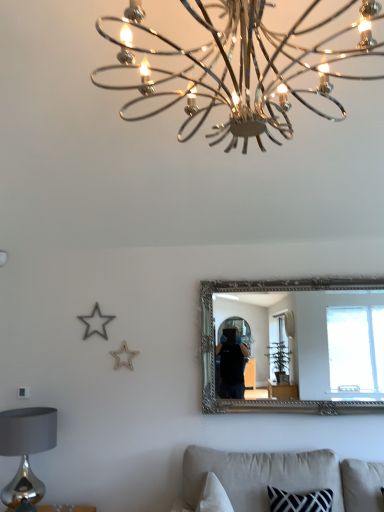
Locate an element on the screen. beige fabric couch at lower center is located at coordinates (282, 478).

What do you see at coordinates (242, 66) in the screenshot?
I see `chrome/metallic chandelier at upper center` at bounding box center [242, 66].

At what (x,y) coordinates should I click in order to perform the action: click on silver ornate mirror at center. Please return your answer as a coordinate pair (x, y). The width and height of the screenshot is (384, 512). Looking at the image, I should click on (318, 339).

Where is `shiny silver table lamp at lower left`? This screenshot has width=384, height=512. shiny silver table lamp at lower left is located at coordinates (26, 449).

From the image's perspective, relative to silver ornate mirror at center, is beige fabric couch at lower center above or below?

From the image's perspective, beige fabric couch at lower center appears below silver ornate mirror at center.

Looking at this image, would you say silver ornate mirror at center is part of beige fabric couch at lower center's contents?

No, silver ornate mirror at center is not surrounded by beige fabric couch at lower center.

Which is nearer, (309, 457) or (337, 303)?

Positioned in front is point (309, 457).

How far apart are beige fabric couch at lower center and silver ornate mirror at center?

beige fabric couch at lower center and silver ornate mirror at center are 3.31 meters apart.

Considering the sizes of objects silver ornate mirror at center and shiny silver table lamp at lower left in the image provided, who is wider, silver ornate mirror at center or shiny silver table lamp at lower left?

shiny silver table lamp at lower left is wider.

What's the angular difference between silver ornate mirror at center and shiny silver table lamp at lower left's facing directions?

There is a 47.5-degree angle between the facing directions of silver ornate mirror at center and shiny silver table lamp at lower left.

Between silver ornate mirror at center and shiny silver table lamp at lower left, which one appears on the right side from the viewer's perspective?

silver ornate mirror at center.

Is silver ornate mirror at center surrounding shiny silver table lamp at lower left?

No.

Would you say shiny silver table lamp at lower left is inside or outside beige fabric couch at lower center?

The correct answer is: outside.

Does shiny silver table lamp at lower left have a greater width compared to beige fabric couch at lower center?

In fact, shiny silver table lamp at lower left might be narrower than beige fabric couch at lower center.

Which is behind, shiny silver table lamp at lower left or beige fabric couch at lower center?

shiny silver table lamp at lower left is behind.

Which object is thinner, chrome/metallic chandelier at upper center or shiny silver table lamp at lower left?

With smaller width is shiny silver table lamp at lower left.

Is chrome/metallic chandelier at upper center facing towards shiny silver table lamp at lower left?

No, chrome/metallic chandelier at upper center is not facing towards shiny silver table lamp at lower left.

Which of these two, chrome/metallic chandelier at upper center or shiny silver table lamp at lower left, is bigger?

With larger size is chrome/metallic chandelier at upper center.

Which object is further away from the camera taking this photo, chrome/metallic chandelier at upper center or shiny silver table lamp at lower left?

shiny silver table lamp at lower left is further from the camera.

Is beige fabric couch at lower center completely or partially outside of shiny silver table lamp at lower left?

Yes, beige fabric couch at lower center is outside of shiny silver table lamp at lower left.

From a real-world perspective, is beige fabric couch at lower center positioned under shiny silver table lamp at lower left based on gravity?

Yes, from a real-world perspective, beige fabric couch at lower center is beneath shiny silver table lamp at lower left.

Is beige fabric couch at lower center far from shiny silver table lamp at lower left?

Yes, beige fabric couch at lower center is far from shiny silver table lamp at lower left.

In terms of height, does beige fabric couch at lower center look taller or shorter compared to shiny silver table lamp at lower left?

Clearly, beige fabric couch at lower center is shorter compared to shiny silver table lamp at lower left.

Considering the positions of objects silver ornate mirror at center and beige fabric couch at lower center in the image provided, who is more to the right, silver ornate mirror at center or beige fabric couch at lower center?

From the viewer's perspective, silver ornate mirror at center appears more on the right side.

Based on the photo, is silver ornate mirror at center oriented towards beige fabric couch at lower center?

No, silver ornate mirror at center is not aimed at beige fabric couch at lower center.

Is silver ornate mirror at center in front of beige fabric couch at lower center?

No, silver ornate mirror at center is further to the viewer.

Is silver ornate mirror at center situated inside beige fabric couch at lower center or outside?

silver ornate mirror at center is spatially situated outside beige fabric couch at lower center.

Does shiny silver table lamp at lower left have a lesser width compared to chrome/metallic chandelier at upper center?

Yes, shiny silver table lamp at lower left is thinner than chrome/metallic chandelier at upper center.

From their relative heights in the image, would you say shiny silver table lamp at lower left is taller or shorter than chrome/metallic chandelier at upper center?

Clearly, shiny silver table lamp at lower left is shorter compared to chrome/metallic chandelier at upper center.

Which is behind, point (30, 449) or point (172, 58)?

The point (30, 449) is farther from the camera.

Identify the location of furniture to the left of silver ornate mirror at center. tap(282, 478).

In order to click on mirror behind the shiny silver table lamp at lower left in this screenshot , I will do `click(318, 339)`.

Which object lies nearer to the anchor point beige fabric couch at lower center, shiny silver table lamp at lower left or silver ornate mirror at center?

Based on the image, shiny silver table lamp at lower left appears to be nearer to beige fabric couch at lower center.

Considering their positions, is beige fabric couch at lower center positioned closer to silver ornate mirror at center than shiny silver table lamp at lower left?

Based on the image, beige fabric couch at lower center appears to be nearer to silver ornate mirror at center.

Considering their positions, is silver ornate mirror at center positioned closer to shiny silver table lamp at lower left than beige fabric couch at lower center?

beige fabric couch at lower center lies closer to shiny silver table lamp at lower left than the other object.

Looking at this image, when comparing their distances from beige fabric couch at lower center, does silver ornate mirror at center or chrome/metallic chandelier at upper center seem further?

silver ornate mirror at center is positioned further to the anchor beige fabric couch at lower center.

Considering their positions, is beige fabric couch at lower center positioned closer to shiny silver table lamp at lower left than chrome/metallic chandelier at upper center?

beige fabric couch at lower center is positioned closer to the anchor shiny silver table lamp at lower left.

Which object lies nearer to the anchor point silver ornate mirror at center, chrome/metallic chandelier at upper center or shiny silver table lamp at lower left?

Among the two, shiny silver table lamp at lower left is located nearer to silver ornate mirror at center.

Which object lies nearer to the anchor point silver ornate mirror at center, chrome/metallic chandelier at upper center or beige fabric couch at lower center?

Among the two, beige fabric couch at lower center is located nearer to silver ornate mirror at center.

Which object lies nearer to the anchor point shiny silver table lamp at lower left, chrome/metallic chandelier at upper center or silver ornate mirror at center?

chrome/metallic chandelier at upper center is closer to shiny silver table lamp at lower left.

At what (x,y) coordinates should I click in order to perform the action: click on table lamp positioned between chrome/metallic chandelier at upper center and silver ornate mirror at center from near to far. Please return your answer as a coordinate pair (x, y). Looking at the image, I should click on (26, 449).

Image resolution: width=384 pixels, height=512 pixels. I want to click on furniture between shiny silver table lamp at lower left and silver ornate mirror at center, so coord(282,478).

Identify the location of mirror between chrome/metallic chandelier at upper center and beige fabric couch at lower center vertically. This screenshot has height=512, width=384. (318, 339).

The image size is (384, 512). I want to click on table lamp between chrome/metallic chandelier at upper center and beige fabric couch at lower center vertically, so [x=26, y=449].